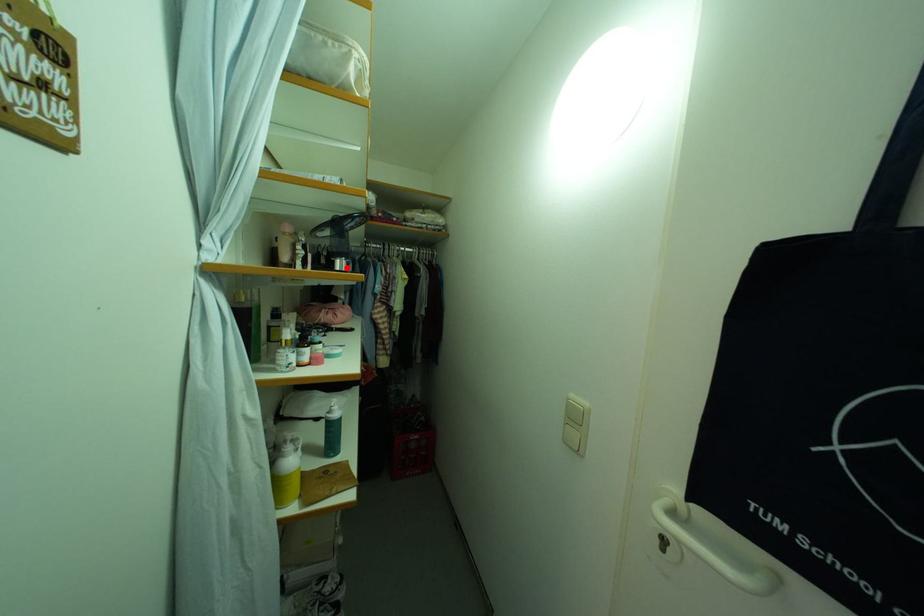
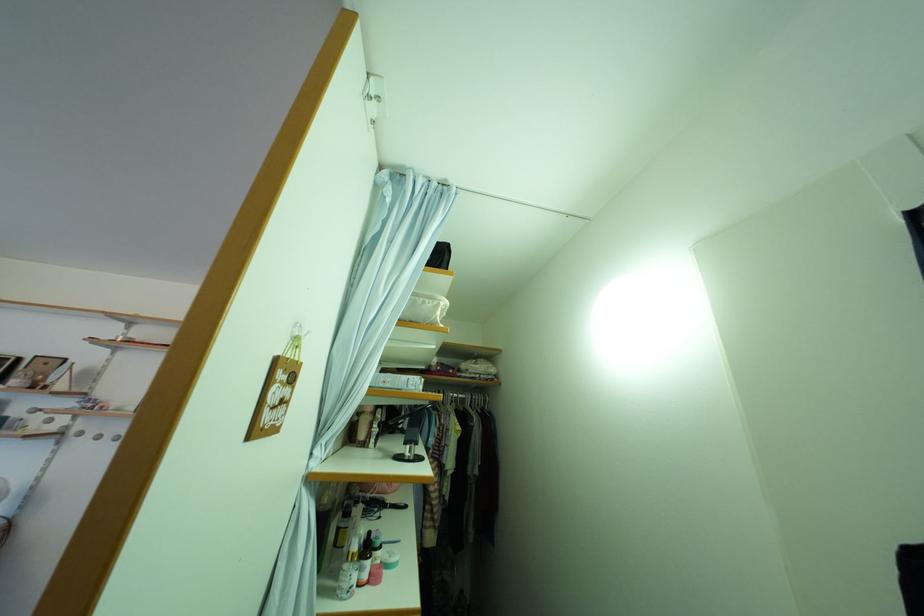
Locate, in the second image, the point that corresponds to the highlighted location in the first image.

(417, 454)